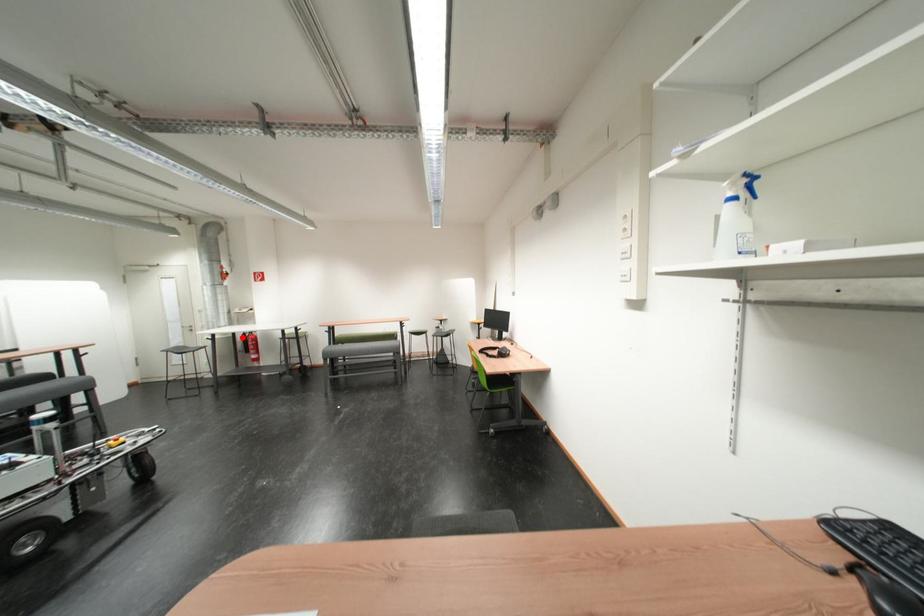
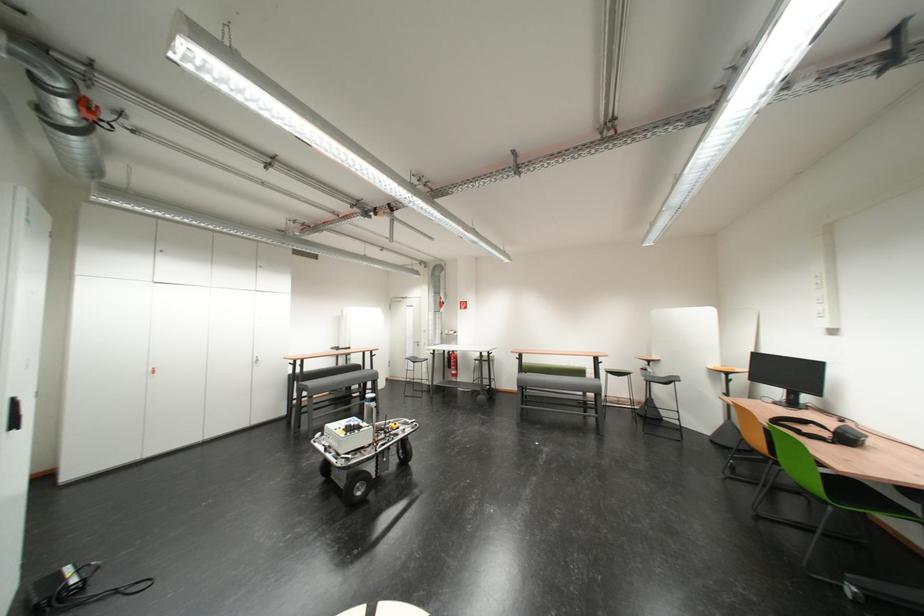
Question: I am providing you with two images of the same scene from different viewpoints. Image1 has a red point marked. In image2, the corresponding 3D location appears at what relative position? Reply with the corresponding letter.

Choices:
 (A) Closer
 (B) Farther

Answer: (B)